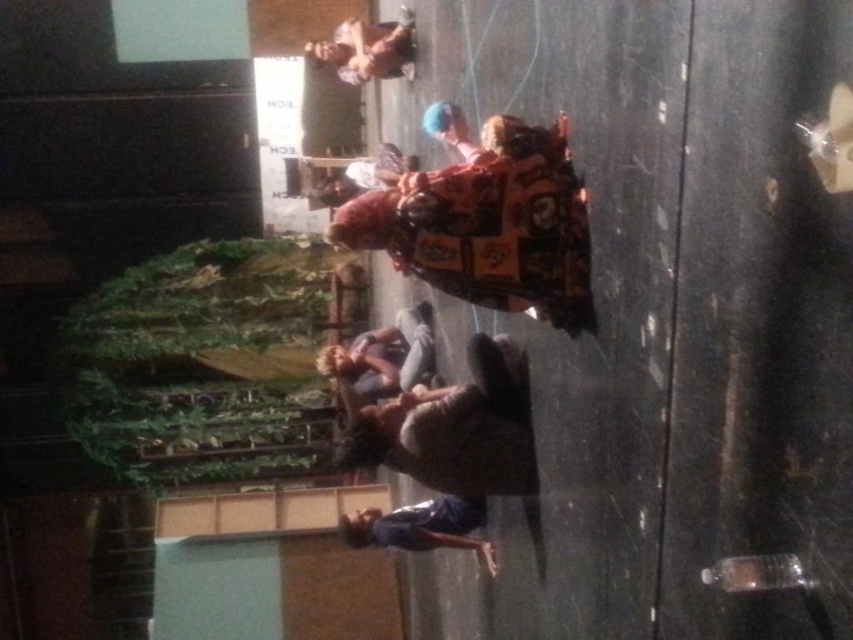
You are at a social gathering and want to move from the point closer to the viewer to the point further away. Which path should you take between the two points, point (x=389, y=516) and point (x=412, y=36)?

You should move from point (x=389, y=516) to point (x=412, y=36) since point (x=389, y=516) is closer to the viewer and the other is further away.

You are at an indoor event and see the matte gray skateboard at center and the dark blue jersey at lower center. Which object is higher up in the image?

The matte gray skateboard at center is taller than the dark blue jersey at lower center, so the skateboard is higher up in the image.

You are at a social gathering and see the matte gray skateboard at center and the matte plastic doll at upper center. Which object is closer to you?

The matte gray skateboard at center is closer to you because it is in front of the matte plastic doll at upper center.